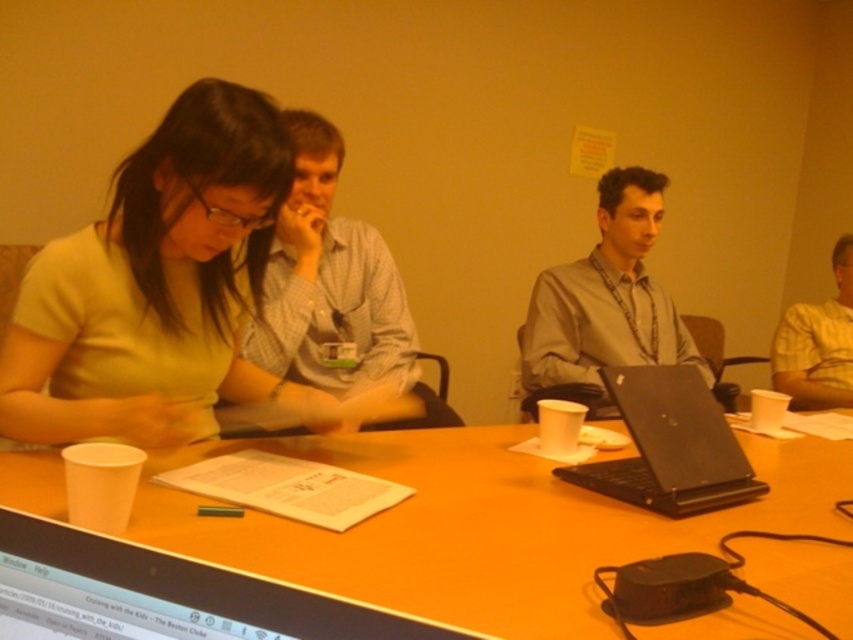
You are sitting at a table in a meeting room and need to place a document on the surface. Considering the objects present, which one between the black glossy computer screen at lower left and the black matte laptop at center would allow you to place the document closer to the edge of the table without obstructing the view of the screen?

The black glossy computer screen at lower left has a lesser height compared to the black matte laptop at center, so placing the document closer to the edge of the table near the black glossy computer screen at lower left would leave more space and avoid blocking the view of its screen.

What object is located at the coordinate point [210,582] in the image?

The point [210,582] is located on the black glossy computer screen at lower left.